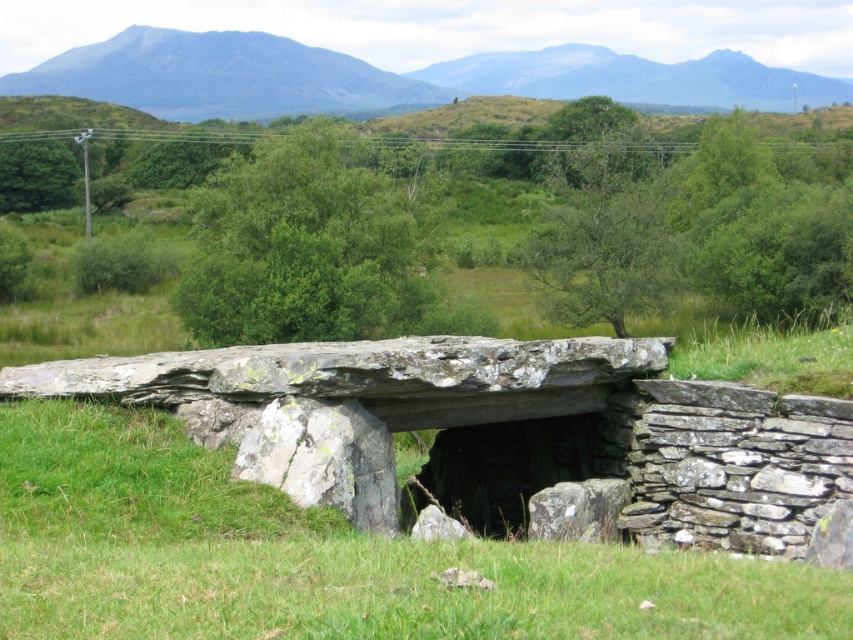
Question: Can you confirm if green grass at center is positioned below blue-green rock formation at upper center?

Choices:
 (A) yes
 (B) no

Answer: (A)

Question: Is green grass at center positioned behind blue-green rock formation at upper center?

Choices:
 (A) yes
 (B) no

Answer: (B)

Question: Which point is closer to the camera?

Choices:
 (A) green grass at center
 (B) blue-green rock formation at upper center
 (C) gray rock mountain at upper center

Answer: (A)

Question: Does blue-green rock formation at upper center appear under gray rock mountain at upper center?

Choices:
 (A) no
 (B) yes

Answer: (A)

Question: Which object is positioned farthest from the gray rock mountain at upper center?

Choices:
 (A) blue-green rock formation at upper center
 (B) green grass at center

Answer: (B)

Question: Which point appears closest to the camera in this image?

Choices:
 (A) (244, 56)
 (B) (724, 61)

Answer: (A)